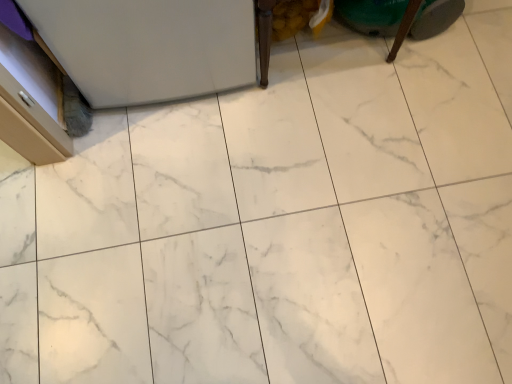
Locate an element on the screen. wooden table at center is located at coordinates (351, 21).

What do you see at coordinates (351, 21) in the screenshot? This screenshot has height=384, width=512. I see `wooden table at center` at bounding box center [351, 21].

In order to face wooden table at center, should I rotate leftwards or rightwards?

You should rotate right by 9.055 degrees.

The image size is (512, 384). What are the coordinates of `wooden table at center` in the screenshot? It's located at (351, 21).